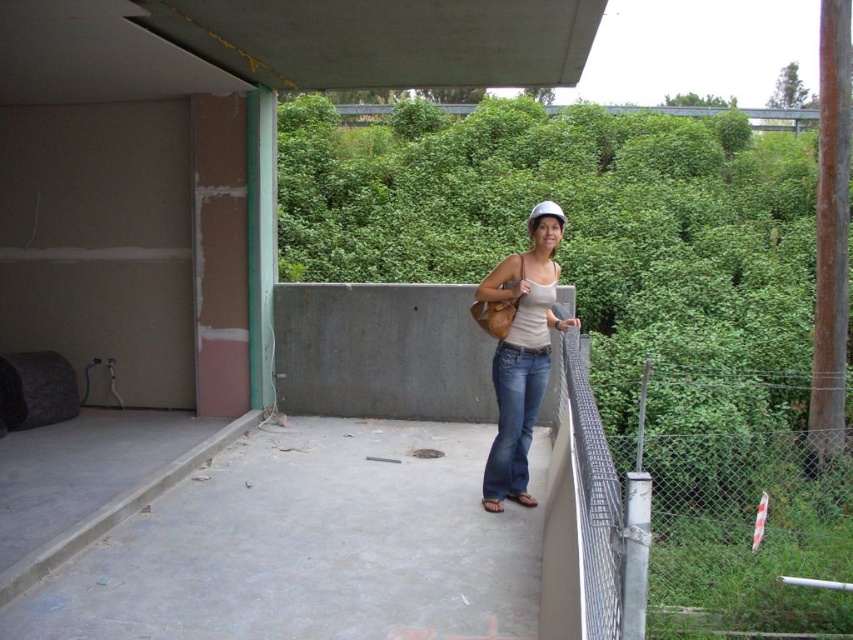
Question: Can you confirm if wire mesh fence at right is positioned below blue denim jeans at center?

Choices:
 (A) yes
 (B) no

Answer: (A)

Question: Is wire mesh fence at right positioned before matte white helmet at center?

Choices:
 (A) yes
 (B) no

Answer: (A)

Question: Which object is closer to the camera taking this photo?

Choices:
 (A) blue denim jeans at center
 (B) matte white helmet at center

Answer: (B)

Question: Which point is closer to the camera?

Choices:
 (A) (788, 588)
 (B) (543, 369)
 (C) (514, 273)

Answer: (C)

Question: Is matte white helmet at center wider than blue denim jeans at center?

Choices:
 (A) yes
 (B) no

Answer: (A)

Question: Which of the following is the farthest from the observer?

Choices:
 (A) (692, 428)
 (B) (521, 371)

Answer: (A)